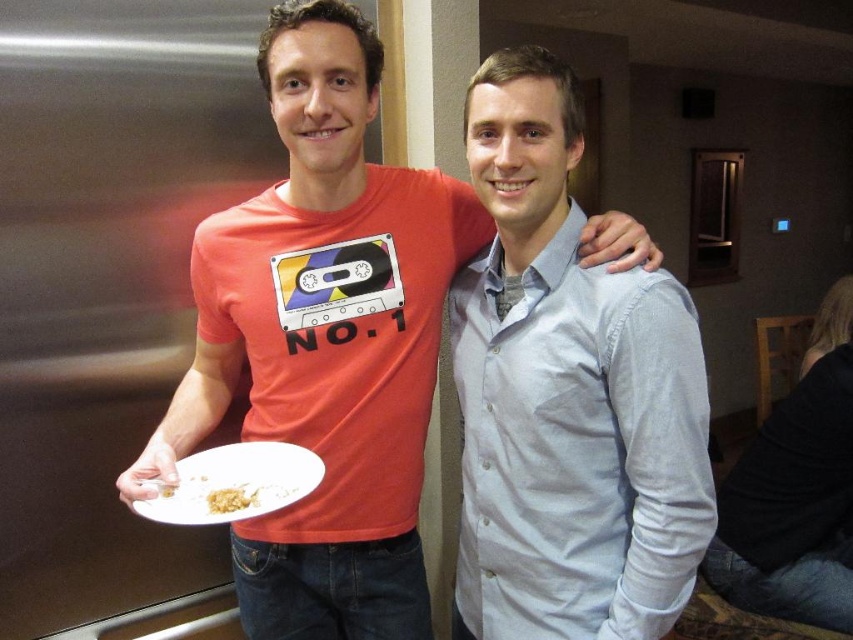
Is matte orange t-shirt at center thinner than yellow crumbly food at plate left?

Incorrect, matte orange t-shirt at center's width is not less than yellow crumbly food at plate left's.

Who is taller, matte orange t-shirt at center or yellow crumbly food at plate left?

matte orange t-shirt at center

Does point (618, 266) come in front of point (251, 500)?

Yes, it is in front of point (251, 500).

You are a GUI agent. You are given a task and a screenshot of the screen. Output one action in this format:
    pyautogui.click(x=<x>, y=<y>)
    Task: Click on the matte orange t-shirt at center
    Image resolution: width=853 pixels, height=640 pixels.
    Given the screenshot: What is the action you would take?
    pyautogui.click(x=323, y=349)

Which is more to the left, white matte plate at lower left or yellow crumbly food at plate left?

white matte plate at lower left

Is point (239, 480) positioned behind point (219, 500)?

Yes.

Describe the element at coordinates (233, 483) in the screenshot. I see `white matte plate at lower left` at that location.

This screenshot has height=640, width=853. I want to click on white matte plate at lower left, so click(x=233, y=483).

Which is above, light blue button-down shirt at center or yellow crumbly food at plate left?

light blue button-down shirt at center is higher up.

Can you confirm if light blue button-down shirt at center is positioned to the left of yellow crumbly food at plate left?

In fact, light blue button-down shirt at center is to the right of yellow crumbly food at plate left.

Where is `light blue button-down shirt at center`? The image size is (853, 640). light blue button-down shirt at center is located at coordinates (567, 396).